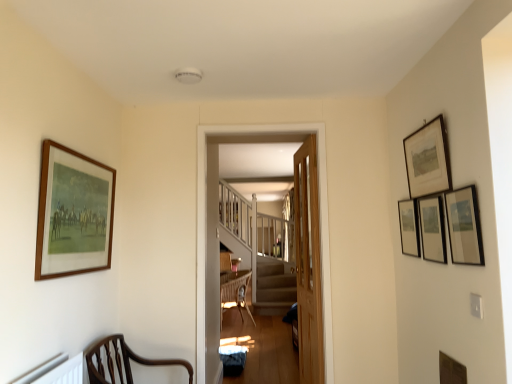
The width and height of the screenshot is (512, 384). What do you see at coordinates (464, 226) in the screenshot?
I see `matte black picture frame at upper right, the second picture frame positioned from the right` at bounding box center [464, 226].

Identify the location of matte black picture frame at upper right, the fourth picture frame positioned from the left. The height and width of the screenshot is (384, 512). (409, 227).

Describe the element at coordinates (308, 264) in the screenshot. I see `light brown wooden door at center` at that location.

Locate an element on the screen. The height and width of the screenshot is (384, 512). matte black picture frame at upper right, which is the 3th picture frame from left to right is located at coordinates (432, 229).

How much space does wooden framed print at upper right, marked as the second picture frame in a left-to-right arrangement, occupy vertically?

wooden framed print at upper right, marked as the second picture frame in a left-to-right arrangement, is 34.55 centimeters in height.

In order to click on matte black picture frame at upper right, the second picture frame positioned from the right in this screenshot , I will do `click(464, 226)`.

Does brown wood chair at lower left have a lesser height compared to wooden framed print at upper right, which ranks as the 5th picture frame in right-to-left order?

In fact, brown wood chair at lower left may be taller than wooden framed print at upper right, which ranks as the 5th picture frame in right-to-left order.

Is brown wood chair at lower left closer to camera compared to wooden framed print at upper right, which ranks as the 5th picture frame in right-to-left order?

No.

Is wooden framed print at upper right, marked as the second picture frame in a left-to-right arrangement, surrounded by brown wood chair at lower left?

Definitely not — wooden framed print at upper right, marked as the second picture frame in a left-to-right arrangement, is not inside brown wood chair at lower left.

Is brown wood chair at lower left to the left or to the right of wooden framed print at upper right, which ranks as the 5th picture frame in right-to-left order, in the image?

Clearly, brown wood chair at lower left is on the left of wooden framed print at upper right, which ranks as the 5th picture frame in right-to-left order, in the image.

How many degrees apart are the facing directions of matte black picture frame at upper right, the 3th picture frame positioned from the right, and matte black picture frame at upper right, the fifth picture frame from the left?

The facing directions of matte black picture frame at upper right, the 3th picture frame positioned from the right, and matte black picture frame at upper right, the fifth picture frame from the left, are 2.17 degrees apart.

From a real-world perspective, is matte black picture frame at upper right, the 3th picture frame positioned from the right, on top of matte black picture frame at upper right, the second picture frame positioned from the right?

Yes.

From the image's perspective, is matte black picture frame at upper right, the 3th picture frame positioned from the right, below matte black picture frame at upper right, the fifth picture frame from the left?

Yes, from the image's perspective, matte black picture frame at upper right, the 3th picture frame positioned from the right, is below matte black picture frame at upper right, the fifth picture frame from the left.

Between wooden framed print at upper right, marked as the second picture frame in a left-to-right arrangement, and wooden picture frame at lower right, arranged as the 6th picture frame when viewed from the left, which one has larger width?

With larger width is wooden framed print at upper right, marked as the second picture frame in a left-to-right arrangement.

Is point (441, 125) closer or farther from the camera than point (466, 373)?

Point (441, 125) appears to be farther away from the viewer than point (466, 373).

Does wooden framed print at upper right, marked as the second picture frame in a left-to-right arrangement, have a greater height compared to wooden picture frame at lower right, which is the first picture frame in right-to-left order?

Indeed, wooden framed print at upper right, marked as the second picture frame in a left-to-right arrangement, has a greater height compared to wooden picture frame at lower right, which is the first picture frame in right-to-left order.

Is wooden framed print at upper right, which ranks as the 5th picture frame in right-to-left order, far from wooden picture frame at lower right, which is the first picture frame in right-to-left order?

No, wooden framed print at upper right, which ranks as the 5th picture frame in right-to-left order, is not far from wooden picture frame at lower right, which is the first picture frame in right-to-left order.

Based on the photo, from the image's perspective, is wooden picture frame at lower right, which is the first picture frame in right-to-left order, above matte black picture frame at upper right, which is the 3th picture frame from left to right?

Incorrect, from the image's perspective, wooden picture frame at lower right, which is the first picture frame in right-to-left order, is lower than matte black picture frame at upper right, which is the 3th picture frame from left to right.

From a real-world perspective, does wooden picture frame at lower right, arranged as the 6th picture frame when viewed from the left, stand above matte black picture frame at upper right, acting as the 4th picture frame starting from the right?

Incorrect, from a real-world perspective, wooden picture frame at lower right, arranged as the 6th picture frame when viewed from the left, is lower than matte black picture frame at upper right, acting as the 4th picture frame starting from the right.

Is wooden picture frame at lower right, arranged as the 6th picture frame when viewed from the left, oriented away from matte black picture frame at upper right, which is the 3th picture frame from left to right?

No, wooden picture frame at lower right, arranged as the 6th picture frame when viewed from the left, is not facing away from matte black picture frame at upper right, which is the 3th picture frame from left to right.

Consider the image. Would you say wooden picture frame at lower right, which is the first picture frame in right-to-left order, is to the left or to the right of matte black picture frame at upper right, which is the 3th picture frame from left to right, in the picture?

wooden picture frame at lower right, which is the first picture frame in right-to-left order, is to the right of matte black picture frame at upper right, which is the 3th picture frame from left to right.

Considering the sizes of objects matte black picture frame at upper right, acting as the 4th picture frame starting from the right, and matte black picture frame at upper right, the second picture frame positioned from the right, in the image provided, who is thinner, matte black picture frame at upper right, acting as the 4th picture frame starting from the right, or matte black picture frame at upper right, the second picture frame positioned from the right,?

matte black picture frame at upper right, acting as the 4th picture frame starting from the right.

Is matte black picture frame at upper right, the second picture frame positioned from the right, completely or partially inside matte black picture frame at upper right, which is the 3th picture frame from left to right?

No, matte black picture frame at upper right, the second picture frame positioned from the right, is not inside matte black picture frame at upper right, which is the 3th picture frame from left to right.

Which is nearer, (443, 220) or (477, 228)?

The point (477, 228) is closer.

Considering the points (199, 197) and (298, 243), which point is behind, point (199, 197) or point (298, 243)?

The point (298, 243) is more distant.

Locate an element on the screen. The height and width of the screenshot is (384, 512). door on the right side of light brown wooden door at center is located at coordinates (308, 264).

Looking at their sizes, would you say light brown wooden door at center is wider or thinner than light brown wooden door at center?

light brown wooden door at center is wider than light brown wooden door at center.

Is light brown wooden door at center positioned in front of light brown wooden door at center?

Yes, the depth of light brown wooden door at center is less than that of light brown wooden door at center.

Can you confirm if matte black picture frame at upper right, which is the 3th picture frame from left to right, is smaller than light brown wooden door at center?

Correct, matte black picture frame at upper right, which is the 3th picture frame from left to right, occupies less space than light brown wooden door at center.

From the image's perspective, is matte black picture frame at upper right, acting as the 4th picture frame starting from the right, positioned above or below light brown wooden door at center?

From the image's perspective, matte black picture frame at upper right, acting as the 4th picture frame starting from the right, appears above light brown wooden door at center.

From a real-world perspective, is matte black picture frame at upper right, acting as the 4th picture frame starting from the right, positioned over light brown wooden door at center based on gravity?

Yes, from a real-world perspective, matte black picture frame at upper right, acting as the 4th picture frame starting from the right, is above light brown wooden door at center.

Does matte black picture frame at upper right, which is the 3th picture frame from left to right, have a greater width compared to light brown wooden door at center?

Incorrect, the width of matte black picture frame at upper right, which is the 3th picture frame from left to right, does not surpass that of light brown wooden door at center.

Locate an element on the screen. The height and width of the screenshot is (384, 512). the 6th picture frame located above the brown wood chair at lower left (from a real-world perspective) is located at coordinates (426, 159).

From the matte black picture frame at upper right, the fourth picture frame positioned from the left, count 5th picture frames forward and point to it. Please provide its 2D coordinates.

[(464, 226)]

Based on their spatial positions, is matte black picture frame at upper right, the second picture frame positioned from the right, or light brown wooden door at center further from matte black picture frame at upper right, which is the 3th picture frame from left to right?

light brown wooden door at center lies further to matte black picture frame at upper right, which is the 3th picture frame from left to right, than the other object.

Based on their spatial positions, is matte black picture frame at upper right, acting as the 4th picture frame starting from the right, or brown wood chair at lower left closer to wooden picture frame at lower right, which is the first picture frame in right-to-left order?

matte black picture frame at upper right, acting as the 4th picture frame starting from the right, lies closer to wooden picture frame at lower right, which is the first picture frame in right-to-left order, than the other object.

Estimate the real-world distances between objects in this image. Which object is further from matte black picture frame at upper right, the 3th picture frame positioned from the right, matte black picture frame at upper right, which is the 3th picture frame from left to right, or wooden frame at left, positioned as the 1th picture frame in left-to-right order?

wooden frame at left, positioned as the 1th picture frame in left-to-right order, is further to matte black picture frame at upper right, the 3th picture frame positioned from the right.

Considering their positions, is light brown wooden door at center positioned closer to brown wood chair at lower left than matte black picture frame at upper right, acting as the 4th picture frame starting from the right?

Based on the image, light brown wooden door at center appears to be nearer to brown wood chair at lower left.

When comparing their distances from light brown wooden door at center, does matte black picture frame at upper right, which is the 3th picture frame from left to right, or light brown wooden door at center seem further?

matte black picture frame at upper right, which is the 3th picture frame from left to right, is positioned further to the anchor light brown wooden door at center.

Looking at the image, which one is located further to light brown wooden door at center, brown wood chair at lower left or wooden framed print at upper right, which ranks as the 5th picture frame in right-to-left order?

Among the two, brown wood chair at lower left is located further to light brown wooden door at center.

Based on their spatial positions, is wooden picture frame at lower right, arranged as the 6th picture frame when viewed from the left, or brown wood chair at lower left further from wooden framed print at upper right, marked as the second picture frame in a left-to-right arrangement?

The object further to wooden framed print at upper right, marked as the second picture frame in a left-to-right arrangement, is brown wood chair at lower left.

Estimate the real-world distances between objects in this image. Which object is further from light brown wooden door at center, wooden picture frame at lower right, which is the first picture frame in right-to-left order, or wooden frame at left, positioned as the 1th picture frame in left-to-right order?

wooden picture frame at lower right, which is the first picture frame in right-to-left order, is positioned further to the anchor light brown wooden door at center.

Where is `corridor between matte black picture frame at upper right, the second picture frame positioned from the right, and light brown wooden door at center, along the z-axis`? corridor between matte black picture frame at upper right, the second picture frame positioned from the right, and light brown wooden door at center, along the z-axis is located at coordinates (206, 229).

Identify the location of chair between wooden frame at left, positioned as the 1th picture frame in left-to-right order, and light brown wooden door at center from left to right. (120, 361).

The height and width of the screenshot is (384, 512). Find the location of `corridor between wooden frame at left, positioned as the sixth picture frame in right-to-left order, and matte black picture frame at upper right, the fifth picture frame from the left`. corridor between wooden frame at left, positioned as the sixth picture frame in right-to-left order, and matte black picture frame at upper right, the fifth picture frame from the left is located at coordinates (206, 229).

Locate an element on the screen. door between wooden frame at left, positioned as the 1th picture frame in left-to-right order, and wooden framed print at upper right, marked as the second picture frame in a left-to-right arrangement is located at coordinates (308, 264).